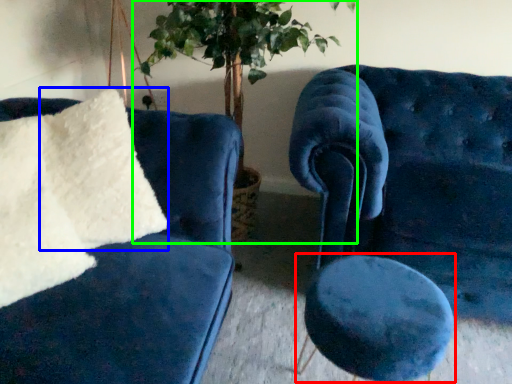
Question: Which object is the closest to the stool (highlighted by a red box)? Choose among these: pillow (highlighted by a blue box) or houseplant (highlighted by a green box).

Choices:
 (A) pillow
 (B) houseplant

Answer: (A)